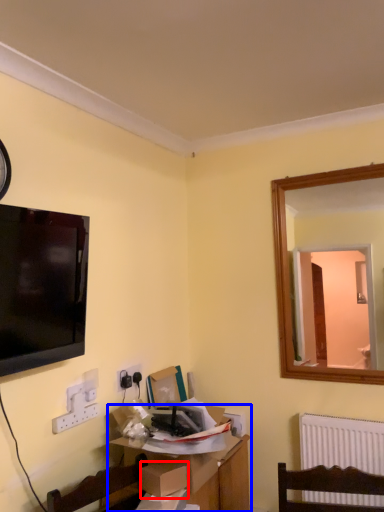
Question: Which object appears closest to the camera in this image, cardboard box (highlighted by a red box) or table (highlighted by a blue box)?

Choices:
 (A) cardboard box
 (B) table

Answer: (A)